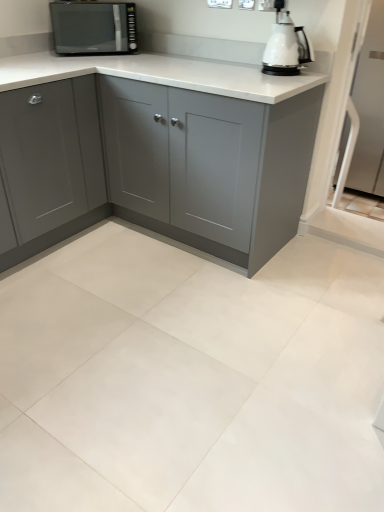
Question: Considering the relative positions of matte gray cabinet at left, the second cabinetry from the right, and satin black microwave at upper left in the image provided, is matte gray cabinet at left, the second cabinetry from the right, to the left or to the right of satin black microwave at upper left?

Choices:
 (A) right
 (B) left

Answer: (B)

Question: In terms of height, does matte gray cabinet at left, the second cabinetry from the right, look taller or shorter compared to satin black microwave at upper left?

Choices:
 (A) short
 (B) tall

Answer: (B)

Question: Which object is positioned farthest from the matte gray cabinet at left, the second cabinetry from the right?

Choices:
 (A) white glossy kettle at upper right
 (B) matte gray cabinet at center, which is the first cabinetry in right-to-left order
 (C) satin black microwave at upper left

Answer: (A)

Question: Which of these objects is positioned farthest from the matte gray cabinet at center, the second cabinetry in the left-to-right sequence?

Choices:
 (A) satin black microwave at upper left
 (B) matte gray cabinet at left, the second cabinetry from the right
 (C) white glossy kettle at upper right

Answer: (A)